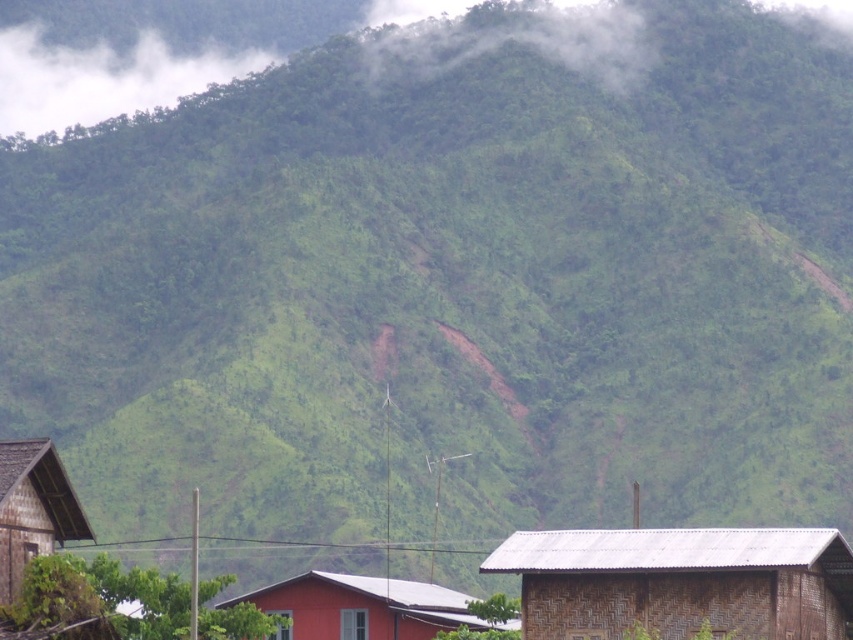
Based on the photo, what are the coordinates of the white foggy cloud at upper center in the image?

The white foggy cloud at upper center is located at coordinates (x=515, y=35).

You are planning to build a new cabin in the mountain area shown. The cabin needs to be as wide as the white foggy cloud at upper center. Can the brown woven hut at lower right fit next to it without overlapping?

The brown woven hut at lower right is narrower than the white foggy cloud at upper center. Therefore, it can fit next to it without overlapping.